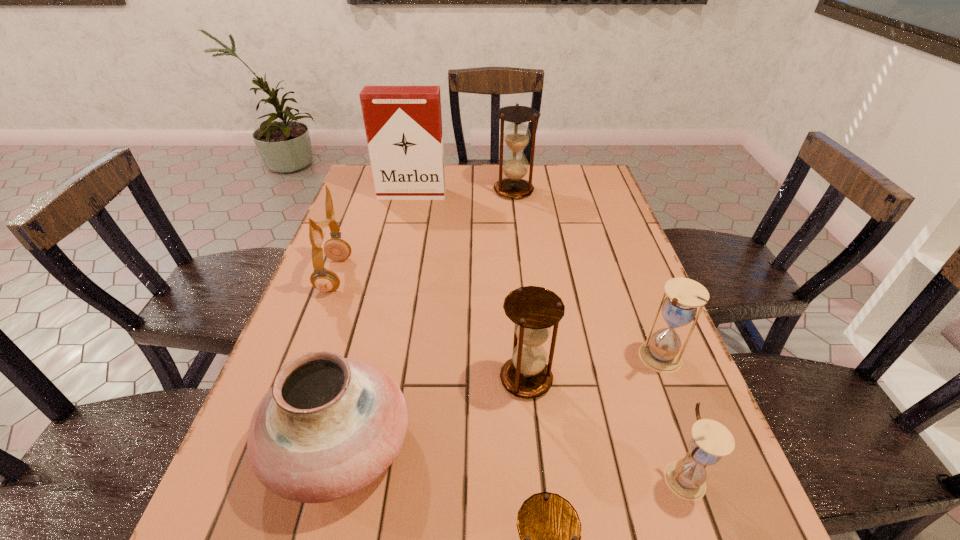
Where is `free point between the sixth nearest object and the farthest brown hourglass`? free point between the sixth nearest object and the farthest brown hourglass is located at coordinates (424, 233).

I want to click on vacant point located between the pottery and the second farthest brown hourglass, so click(433, 413).

Choose which object is the second nearest neighbor to the farthest brown hourglass. Please provide its 2D coordinates. Your answer should be formatted as a tuple, i.e. [(x, y)], where the tuple contains the x and y coordinates of a point satisfying the conditions above.

[(325, 280)]

Image resolution: width=960 pixels, height=540 pixels. What are the coordinates of `object identified as the seventh closest to the second nearest hourglass` in the screenshot? It's located at tap(403, 124).

At what (x,y) coordinates should I click in order to perform the action: click on the second closest hourglass relative to the second farthest brown hourglass. Please return your answer as a coordinate pair (x, y). The height and width of the screenshot is (540, 960). Looking at the image, I should click on (711, 440).

Identify which hourglass is located as the fourth nearest to the earphone. Please provide its 2D coordinates. Your answer should be formatted as a tuple, i.e. [(x, y)], where the tuple contains the x and y coordinates of a point satisfying the conditions above.

[(661, 353)]

Locate an element on the screen. The height and width of the screenshot is (540, 960). the closest brown hourglass to the bigger white hourglass is located at coordinates (534, 310).

The height and width of the screenshot is (540, 960). I want to click on brown hourglass that is the nearest to the bigger white hourglass, so click(534, 310).

In order to click on free point that satisfies the following two spatial constraints: 1. on the front-facing side of the second smallest brown hourglass; 2. on the left side of the tallest object in this screenshot , I will do `click(371, 379)`.

Find the location of a particular element. free spot that satisfies the following two spatial constraints: 1. on the front side of the nearer white hourglass; 2. on the left side of the second farthest brown hourglass is located at coordinates (536, 477).